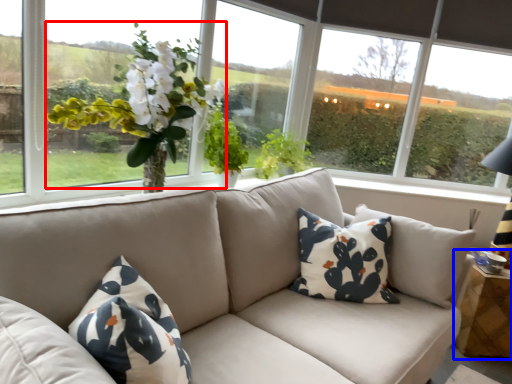
Question: Which object appears farthest to the camera in this image, floral arrangement (highlighted by a red box) or table (highlighted by a blue box)?

Choices:
 (A) floral arrangement
 (B) table

Answer: (B)